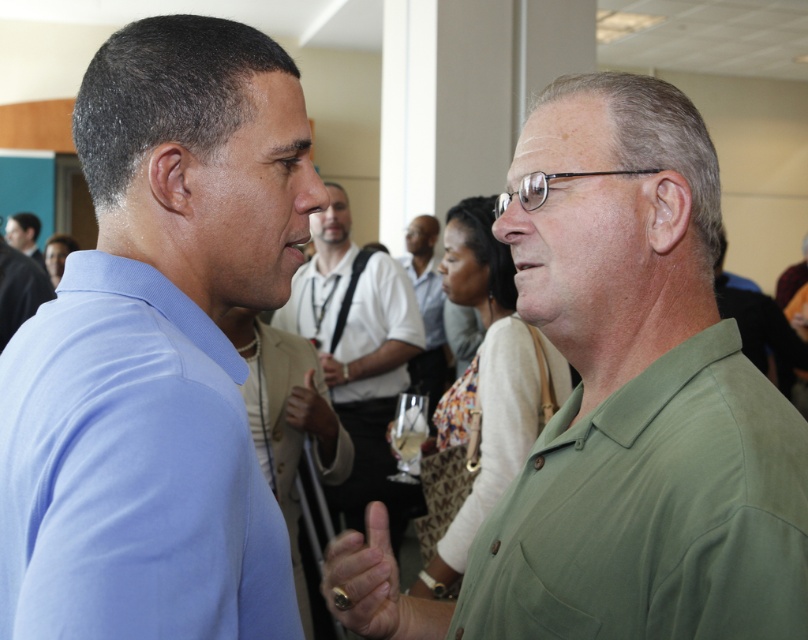
Which of these two, light blue shirt at left or matte blue shirt at left, stands taller?

light blue shirt at left

Is light blue shirt at left to the left of matte blue shirt at left from the viewer's perspective?

In fact, light blue shirt at left is to the right of matte blue shirt at left.

Is point (289, 122) positioned before point (7, 218)?

Yes, it is in front of point (7, 218).

This screenshot has width=808, height=640. Identify the location of light blue shirt at left. (158, 349).

Is light blue shirt at left thinner than matte green shirt at center?

No.

Can you confirm if light blue shirt at left is positioned below matte green shirt at center?

Yes, light blue shirt at left is below matte green shirt at center.

You are a GUI agent. You are given a task and a screenshot of the screen. Output one action in this format:
    pyautogui.click(x=<x>, y=<y>)
    Task: Click on the light blue shirt at left
    This screenshot has height=640, width=808.
    Given the screenshot: What is the action you would take?
    pyautogui.click(x=158, y=349)

Where is `light blue shirt at left`? Image resolution: width=808 pixels, height=640 pixels. light blue shirt at left is located at coordinates (158, 349).

Which is in front, point (11, 340) or point (347, 500)?

Point (11, 340) is more forward.

From the picture: Which of these two, light blue shirt at left or matte blue shirt at center, stands taller?

Standing taller between the two is matte blue shirt at center.

Image resolution: width=808 pixels, height=640 pixels. Describe the element at coordinates (158, 349) in the screenshot. I see `light blue shirt at left` at that location.

Locate an element on the screen. This screenshot has height=640, width=808. light blue shirt at left is located at coordinates (158, 349).